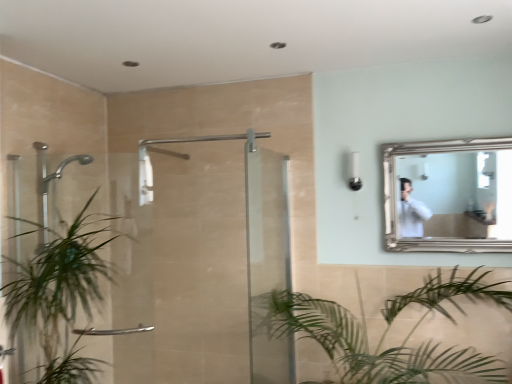
What is the approximate height of clear glass shower door at left, placed as the 1th screen door when sorted from left to right?

4.11 feet.

The image size is (512, 384). Describe the element at coordinates (457, 195) in the screenshot. I see `silver/golden frame mirror at upper right` at that location.

How much space does green leafy plant at left, placed as the second houseplant when sorted from right to left, occupy vertically?

green leafy plant at left, placed as the second houseplant when sorted from right to left, is 1.06 meters tall.

You are a GUI agent. You are given a task and a screenshot of the screen. Output one action in this format:
    pyautogui.click(x=<x>, y=<y>)
    Task: Click on the green leafy plant at lower center, marked as the 2th houseplant in a left-to-right arrangement
    The image size is (512, 384).
    Given the screenshot: What is the action you would take?
    pyautogui.click(x=386, y=332)

From the image's perspective, is green leafy plant at lower center, the 1th houseplant viewed from the right, located above or below clear glass door at center, which is counted as the 2th screen door, starting from the left?

Based on their image positions, green leafy plant at lower center, the 1th houseplant viewed from the right, is located beneath clear glass door at center, which is counted as the 2th screen door, starting from the left.

From a real-world perspective, relative to clear glass door at center, placed as the 1th screen door when sorted from right to left, is green leafy plant at lower center, the 1th houseplant viewed from the right, vertically above or below?

In terms of real-world spatial position, green leafy plant at lower center, the 1th houseplant viewed from the right, is below clear glass door at center, placed as the 1th screen door when sorted from right to left.

From the picture: Which is more to the left, green leafy plant at lower center, the 1th houseplant viewed from the right, or clear glass door at center, which is counted as the 2th screen door, starting from the left?

clear glass door at center, which is counted as the 2th screen door, starting from the left.

In terms of size, does green leafy plant at lower center, the 1th houseplant viewed from the right, appear bigger or smaller than clear glass door at center, placed as the 1th screen door when sorted from right to left?

Considering their sizes, green leafy plant at lower center, the 1th houseplant viewed from the right, takes up more space than clear glass door at center, placed as the 1th screen door when sorted from right to left.

Is clear glass door at center, placed as the 1th screen door when sorted from right to left, far from silver/golden frame mirror at upper right?

No.

Looking at this image, considering the sizes of objects clear glass door at center, which is counted as the 2th screen door, starting from the left, and silver/golden frame mirror at upper right in the image provided, who is smaller, clear glass door at center, which is counted as the 2th screen door, starting from the left, or silver/golden frame mirror at upper right?

silver/golden frame mirror at upper right.

Is green leafy plant at lower center, marked as the 2th houseplant in a left-to-right arrangement, to the left of clear glass shower door at left, acting as the 2th screen door starting from the right, from the viewer's perspective?

No.

Is green leafy plant at lower center, marked as the 2th houseplant in a left-to-right arrangement, far away from clear glass shower door at left, placed as the 1th screen door when sorted from left to right?

green leafy plant at lower center, marked as the 2th houseplant in a left-to-right arrangement, is actually quite close to clear glass shower door at left, placed as the 1th screen door when sorted from left to right.

Is green leafy plant at lower center, the 1th houseplant viewed from the right, positioned with its back to clear glass shower door at left, acting as the 2th screen door starting from the right?

No, clear glass shower door at left, acting as the 2th screen door starting from the right, is not at the back of green leafy plant at lower center, the 1th houseplant viewed from the right.

Which houseplant is the 2nd one when counting from the front of the clear glass shower door at left, acting as the 2th screen door starting from the right? Please provide its 2D coordinates.

[(386, 332)]

Locate an element on the screen. the 1st houseplant located beneath the clear glass shower door at left, acting as the 2th screen door starting from the right (from a real-world perspective) is located at coordinates (61, 296).

Is green leafy plant at left, placed as the second houseplant when sorted from right to left, not near clear glass shower door at left, acting as the 2th screen door starting from the right?

No, there isn't a large distance between green leafy plant at left, placed as the second houseplant when sorted from right to left, and clear glass shower door at left, acting as the 2th screen door starting from the right.

Which is closer, (92, 223) or (256, 205)?

Point (92, 223).

Consider the image. Visually, is white plastic light fixture at upper center positioned to the left or to the right of clear glass door at center, placed as the 1th screen door when sorted from right to left?

From the image, it's evident that white plastic light fixture at upper center is to the right of clear glass door at center, placed as the 1th screen door when sorted from right to left.

From a real-world perspective, who is located higher, white plastic light fixture at upper center or clear glass door at center, which is counted as the 2th screen door, starting from the left?

white plastic light fixture at upper center, from a real-world perspective.

How many degrees apart are the facing directions of white plastic light fixture at upper center and clear glass door at center, placed as the 1th screen door when sorted from right to left?

The angle between the facing direction of white plastic light fixture at upper center and the facing direction of clear glass door at center, placed as the 1th screen door when sorted from right to left, is 89.2 degrees.

In the scene shown: Can you confirm if white plastic light fixture at upper center is shorter than clear glass door at center, placed as the 1th screen door when sorted from right to left?

Correct, white plastic light fixture at upper center is not as tall as clear glass door at center, placed as the 1th screen door when sorted from right to left.

From a real-world perspective, is silver/golden frame mirror at upper right positioned under green leafy plant at lower center, marked as the 2th houseplant in a left-to-right arrangement, based on gravity?

No, from a real-world perspective, silver/golden frame mirror at upper right is not under green leafy plant at lower center, marked as the 2th houseplant in a left-to-right arrangement.

Which of these two, silver/golden frame mirror at upper right or green leafy plant at lower center, marked as the 2th houseplant in a left-to-right arrangement, is thinner?

silver/golden frame mirror at upper right.

From the image's perspective, is silver/golden frame mirror at upper right located above green leafy plant at lower center, marked as the 2th houseplant in a left-to-right arrangement?

Indeed, from the image's perspective, silver/golden frame mirror at upper right is shown above green leafy plant at lower center, marked as the 2th houseplant in a left-to-right arrangement.

Considering the sizes of objects clear glass shower door at left, placed as the 1th screen door when sorted from left to right, and green leafy plant at lower center, the 1th houseplant viewed from the right, in the image provided, who is wider, clear glass shower door at left, placed as the 1th screen door when sorted from left to right, or green leafy plant at lower center, the 1th houseplant viewed from the right,?

green leafy plant at lower center, the 1th houseplant viewed from the right, is wider.

From the picture: From the image's perspective, relative to green leafy plant at lower center, marked as the 2th houseplant in a left-to-right arrangement, is clear glass shower door at left, placed as the 1th screen door when sorted from left to right, above or below?

Based on their image positions, clear glass shower door at left, placed as the 1th screen door when sorted from left to right, is located above green leafy plant at lower center, marked as the 2th houseplant in a left-to-right arrangement.

Is clear glass shower door at left, acting as the 2th screen door starting from the right, smaller than green leafy plant at lower center, marked as the 2th houseplant in a left-to-right arrangement?

Yes.

Between clear glass shower door at left, placed as the 1th screen door when sorted from left to right, and green leafy plant at lower center, marked as the 2th houseplant in a left-to-right arrangement, which one has more height?

Standing taller between the two is clear glass shower door at left, placed as the 1th screen door when sorted from left to right.

Where is `screen door that is the 1st object located above the green leafy plant at lower center, marked as the 2th houseplant in a left-to-right arrangement (from the image's perspective)`? screen door that is the 1st object located above the green leafy plant at lower center, marked as the 2th houseplant in a left-to-right arrangement (from the image's perspective) is located at coordinates (267, 261).

The image size is (512, 384). I want to click on mirror that is above the clear glass door at center, placed as the 1th screen door when sorted from right to left (from a real-world perspective), so click(x=457, y=195).

Looking at the image, which one is located further to white plastic light fixture at upper center, clear glass door at center, which is counted as the 2th screen door, starting from the left, or silver/golden frame mirror at upper right?

clear glass door at center, which is counted as the 2th screen door, starting from the left, is positioned further to the anchor white plastic light fixture at upper center.

From the image, which object appears to be farther from green leafy plant at left, which ranks as the 1th houseplant in left-to-right order, green leafy plant at lower center, marked as the 2th houseplant in a left-to-right arrangement, or clear glass door at center, placed as the 1th screen door when sorted from right to left?

green leafy plant at lower center, marked as the 2th houseplant in a left-to-right arrangement.

When comparing their distances from green leafy plant at lower center, the 1th houseplant viewed from the right, does silver/golden frame mirror at upper right or green leafy plant at left, which ranks as the 1th houseplant in left-to-right order, seem further?

green leafy plant at left, which ranks as the 1th houseplant in left-to-right order, lies further to green leafy plant at lower center, the 1th houseplant viewed from the right, than the other object.

Based on their spatial positions, is clear glass shower door at left, placed as the 1th screen door when sorted from left to right, or clear glass door at center, which is counted as the 2th screen door, starting from the left, further from silver/golden frame mirror at upper right?

clear glass shower door at left, placed as the 1th screen door when sorted from left to right, is further to silver/golden frame mirror at upper right.

Looking at this image, which object lies further to the anchor point silver/golden frame mirror at upper right, green leafy plant at left, which ranks as the 1th houseplant in left-to-right order, or clear glass door at center, placed as the 1th screen door when sorted from right to left?

green leafy plant at left, which ranks as the 1th houseplant in left-to-right order.

When comparing their distances from green leafy plant at left, placed as the second houseplant when sorted from right to left, does silver/golden frame mirror at upper right or green leafy plant at lower center, marked as the 2th houseplant in a left-to-right arrangement, seem further?

silver/golden frame mirror at upper right lies further to green leafy plant at left, placed as the second houseplant when sorted from right to left, than the other object.

From the image, which object appears to be farther from clear glass door at center, which is counted as the 2th screen door, starting from the left, clear glass shower door at left, acting as the 2th screen door starting from the right, or green leafy plant at left, which ranks as the 1th houseplant in left-to-right order?

Among the two, green leafy plant at left, which ranks as the 1th houseplant in left-to-right order, is located further to clear glass door at center, which is counted as the 2th screen door, starting from the left.

From the image, which object appears to be nearer to clear glass shower door at left, acting as the 2th screen door starting from the right, green leafy plant at lower center, the 1th houseplant viewed from the right, or white plastic light fixture at upper center?

green leafy plant at lower center, the 1th houseplant viewed from the right.

What are the coordinates of `screen door between clear glass shower door at left, placed as the 1th screen door when sorted from left to right, and green leafy plant at lower center, the 1th houseplant viewed from the right` in the screenshot? It's located at (267, 261).

This screenshot has height=384, width=512. In order to click on light fixture between green leafy plant at left, placed as the second houseplant when sorted from right to left, and green leafy plant at lower center, marked as the 2th houseplant in a left-to-right arrangement, from left to right in this screenshot , I will do `click(354, 172)`.

Find the location of a particular element. light fixture located between green leafy plant at left, which ranks as the 1th houseplant in left-to-right order, and silver/golden frame mirror at upper right in the left-right direction is located at coordinates (354, 172).

The image size is (512, 384). Identify the location of light fixture between clear glass door at center, which is counted as the 2th screen door, starting from the left, and silver/golden frame mirror at upper right, in the horizontal direction. 354,172.